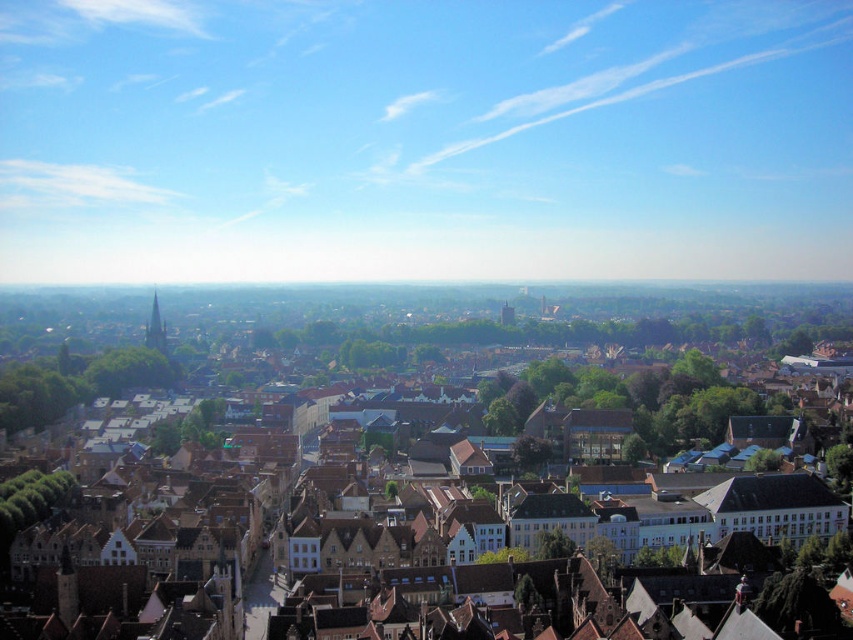
Question: Which of the following is the farthest from the observer?

Choices:
 (A) (155, 323)
 (B) (515, 461)

Answer: (A)

Question: Considering the relative positions of brown brick buildings at center and green stone tower at left in the image provided, where is brown brick buildings at center located with respect to green stone tower at left?

Choices:
 (A) right
 (B) left

Answer: (A)

Question: Does brown brick buildings at center appear on the left side of green stone tower at left?

Choices:
 (A) no
 (B) yes

Answer: (A)

Question: Which point is farther to the camera?

Choices:
 (A) (161, 353)
 (B) (532, 536)

Answer: (A)

Question: Is brown brick buildings at center wider than green stone tower at left?

Choices:
 (A) no
 (B) yes

Answer: (B)

Question: Which point appears closest to the camera in this image?

Choices:
 (A) (151, 342)
 (B) (33, 378)

Answer: (B)